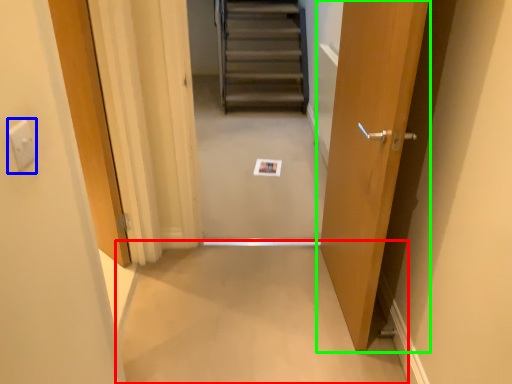
Question: Which object is the farthest from plain (highlighted by a red box)? Choose among these: electric outlet (highlighted by a blue box) or door (highlighted by a green box).

Choices:
 (A) electric outlet
 (B) door

Answer: (A)